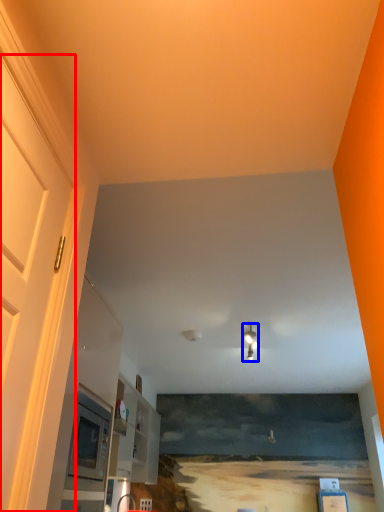
Question: Which point is closer to the camera, door (highlighted by a red box) or light fixture (highlighted by a blue box)?

Choices:
 (A) door
 (B) light fixture

Answer: (A)